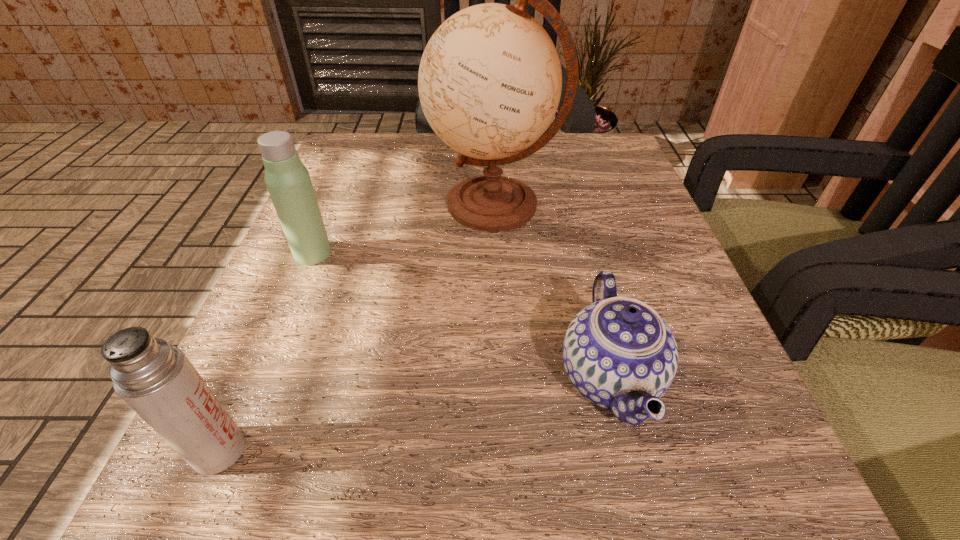
Find the location of a particular element. globe is located at coordinates (490, 80).

I want to click on the farthest object, so click(490, 80).

You are a GUI agent. You are given a task and a screenshot of the screen. Output one action in this format:
    pyautogui.click(x=<x>, y=<y>)
    Task: Click on the second farthest object
    
    Given the screenshot: What is the action you would take?
    pyautogui.click(x=288, y=181)

This screenshot has height=540, width=960. Find the location of `the nearer thermos bottle`. the nearer thermos bottle is located at coordinates (156, 379).

This screenshot has height=540, width=960. I want to click on the shortest object, so click(618, 353).

In order to click on free space located on the surface of the globe in this screenshot , I will do `click(397, 205)`.

Where is `free region located on the surface of the globe`? free region located on the surface of the globe is located at coordinates (381, 205).

The image size is (960, 540). Find the location of `free point located 0.050m on the surface of the globe`. free point located 0.050m on the surface of the globe is located at coordinates (403, 205).

Find the location of a particular element. blank area located on the front of the farther thermos bottle is located at coordinates (261, 379).

You are a GUI agent. You are given a task and a screenshot of the screen. Output one action in this format:
    pyautogui.click(x=<x>, y=<y>)
    Task: Click on the vacant area situated on the back of the nearer thermos bottle
    The width and height of the screenshot is (960, 540).
    Given the screenshot: What is the action you would take?
    pyautogui.click(x=320, y=219)